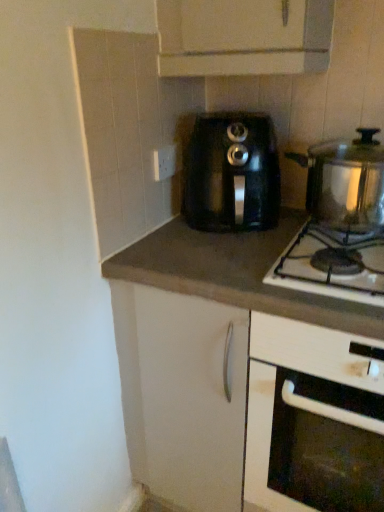
Question: Does white glossy oven at lower right have a lesser height compared to white plastic electric outlet at upper center?

Choices:
 (A) yes
 (B) no

Answer: (B)

Question: Does white glossy oven at lower right have a greater width compared to white plastic electric outlet at upper center?

Choices:
 (A) yes
 (B) no

Answer: (A)

Question: From a real-world perspective, is white glossy oven at lower right positioned under white plastic electric outlet at upper center based on gravity?

Choices:
 (A) no
 (B) yes

Answer: (B)

Question: From the image's perspective, is white glossy oven at lower right above white plastic electric outlet at upper center?

Choices:
 (A) yes
 (B) no

Answer: (B)

Question: Is white glossy oven at lower right not near white plastic electric outlet at upper center?

Choices:
 (A) yes
 (B) no

Answer: (B)

Question: Can you confirm if white glossy oven at lower right is positioned to the left of white plastic electric outlet at upper center?

Choices:
 (A) yes
 (B) no

Answer: (B)

Question: From the image's perspective, is white glossy oven at lower right located beneath black plastic coffee maker at center, placed as the second kitchen appliance when sorted from right to left?

Choices:
 (A) yes
 (B) no

Answer: (A)

Question: Can you confirm if white glossy oven at lower right is shorter than black plastic coffee maker at center, placed as the second kitchen appliance when sorted from right to left?

Choices:
 (A) no
 (B) yes

Answer: (A)

Question: Is black plastic coffee maker at center, which is counted as the 1th kitchen appliance, starting from the left, at the back of white glossy oven at lower right?

Choices:
 (A) no
 (B) yes

Answer: (A)

Question: Is the depth of white glossy oven at lower right greater than that of black plastic coffee maker at center, placed as the second kitchen appliance when sorted from right to left?

Choices:
 (A) no
 (B) yes

Answer: (A)

Question: Is white glossy oven at lower right taller than black plastic coffee maker at center, which is counted as the 1th kitchen appliance, starting from the left?

Choices:
 (A) no
 (B) yes

Answer: (B)

Question: Is white glossy oven at lower right placed right next to black plastic coffee maker at center, which is counted as the 1th kitchen appliance, starting from the left?

Choices:
 (A) no
 (B) yes

Answer: (A)

Question: Is white plastic electric outlet at upper center placed right next to black plastic coffee maker at center, which is counted as the 1th kitchen appliance, starting from the left?

Choices:
 (A) no
 (B) yes

Answer: (A)